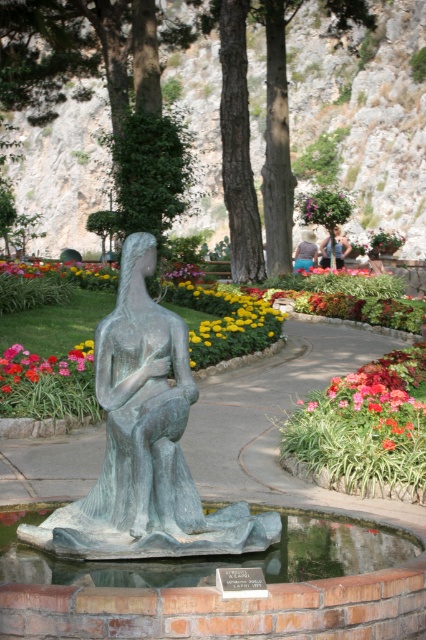
Question: Which of the following is the farthest from the observer?

Choices:
 (A) red matte flower at lower right
 (B) vivid pink petals at center

Answer: (B)

Question: Does green patina statue at center have a smaller size compared to red matte flower at lower right?

Choices:
 (A) yes
 (B) no

Answer: (A)

Question: Is bronze statue at center to the left of red matte flower at lower right from the viewer's perspective?

Choices:
 (A) yes
 (B) no

Answer: (A)

Question: Can you confirm if red matte flower at lower right is thinner than light brown hair at center?

Choices:
 (A) yes
 (B) no

Answer: (B)

Question: Which point is closer to the camera?

Choices:
 (A) (43, 360)
 (B) (340, 248)
 (C) (135, 275)

Answer: (C)

Question: Which object is positioned closest to the bronze statue at center?

Choices:
 (A) light brown hair at center
 (B) green patina statue at center

Answer: (B)